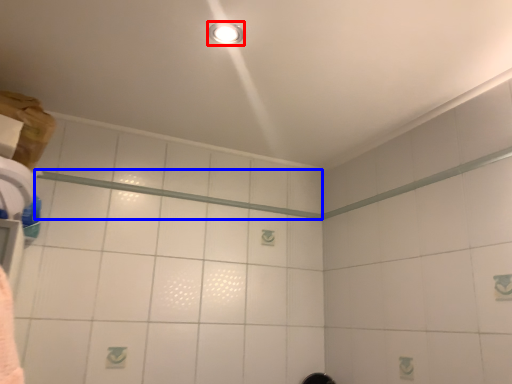
Question: Which point is further to the camera, light fixture (highlighted by a red box) or beam (highlighted by a blue box)?

Choices:
 (A) light fixture
 (B) beam

Answer: (B)